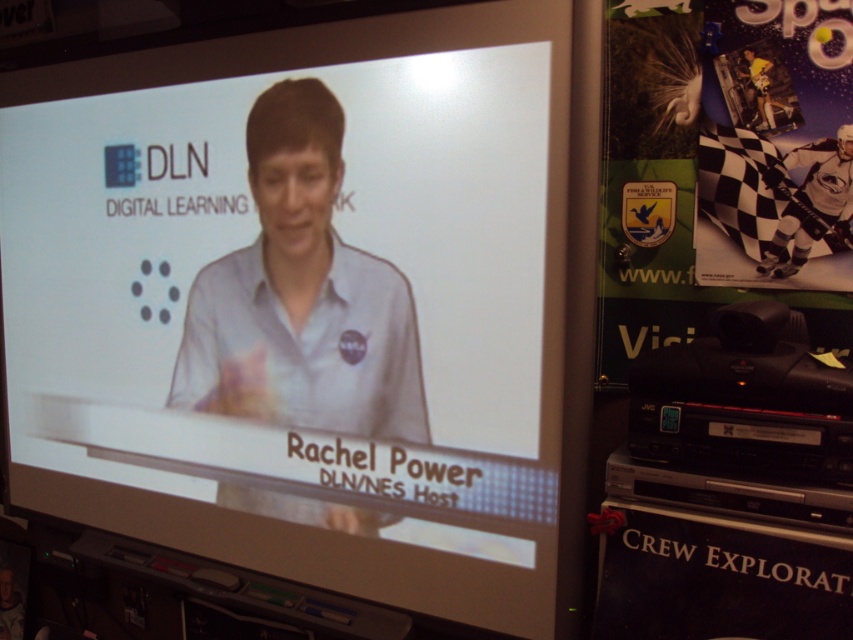
Is green matte poster at right smaller than matte blue shirt at center?

Indeed, green matte poster at right has a smaller size compared to matte blue shirt at center.

Between point (839, 67) and point (341, 369), which one is positioned in front?

Point (839, 67) is more forward.

Where is `green matte poster at right`? The height and width of the screenshot is (640, 853). green matte poster at right is located at coordinates (724, 168).

Based on the photo, does white glossy screen at center have a lesser width compared to matte blue shirt at center?

Result: No.

Between white glossy screen at center and matte blue shirt at center, which one appears on the left side from the viewer's perspective?

From the viewer's perspective, white glossy screen at center appears more on the left side.

Where is `white glossy screen at center`? The width and height of the screenshot is (853, 640). white glossy screen at center is located at coordinates (300, 301).

The width and height of the screenshot is (853, 640). Identify the location of white glossy screen at center. (300, 301).

Is white glossy screen at center smaller than green matte poster at right?

No, white glossy screen at center is not smaller than green matte poster at right.

The image size is (853, 640). Describe the element at coordinates (300, 301) in the screenshot. I see `white glossy screen at center` at that location.

Is point (112, 440) positioned before point (717, 285)?

No.

Locate an element on the screen. This screenshot has width=853, height=640. white glossy screen at center is located at coordinates (300, 301).